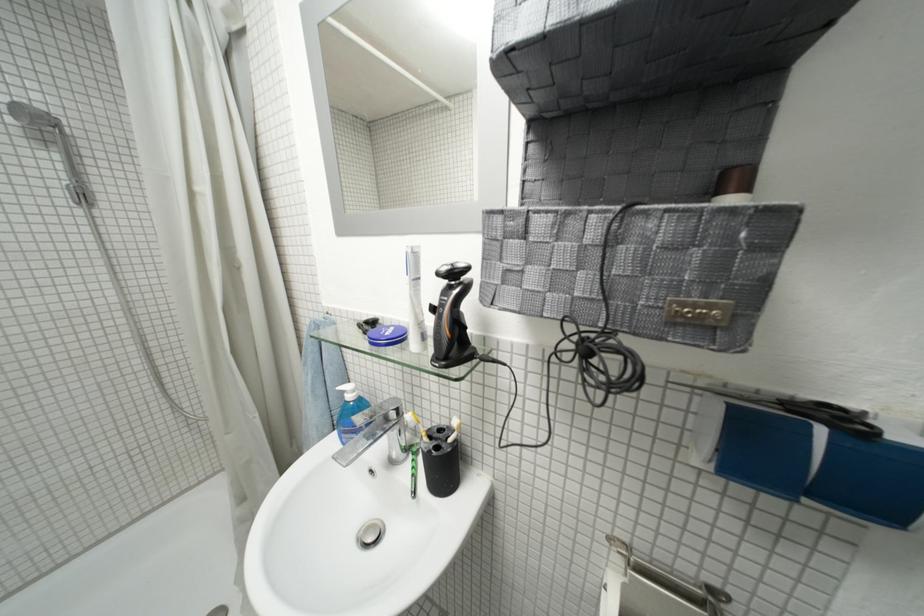
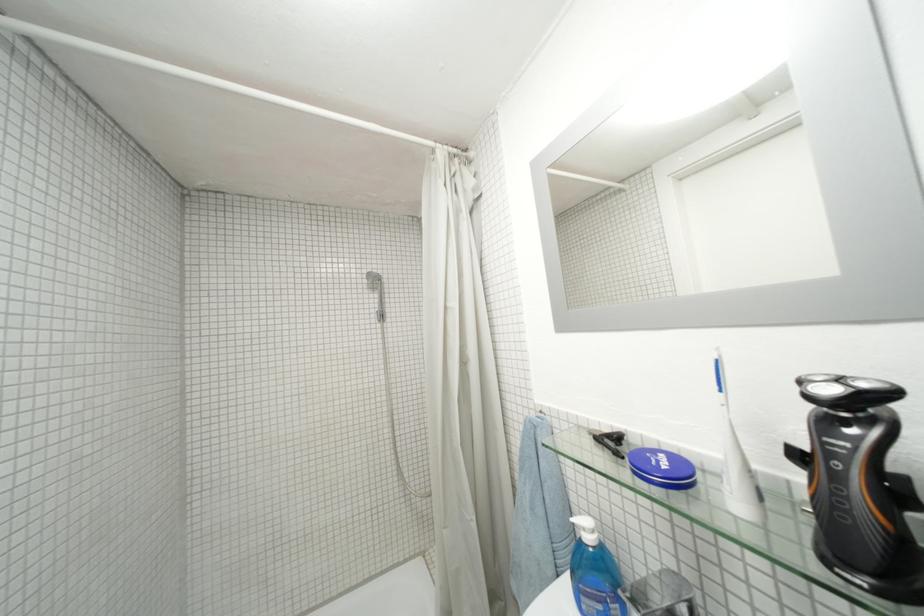
In the second image, find the point that corresponds to pixel 359 399 in the first image.

(598, 541)